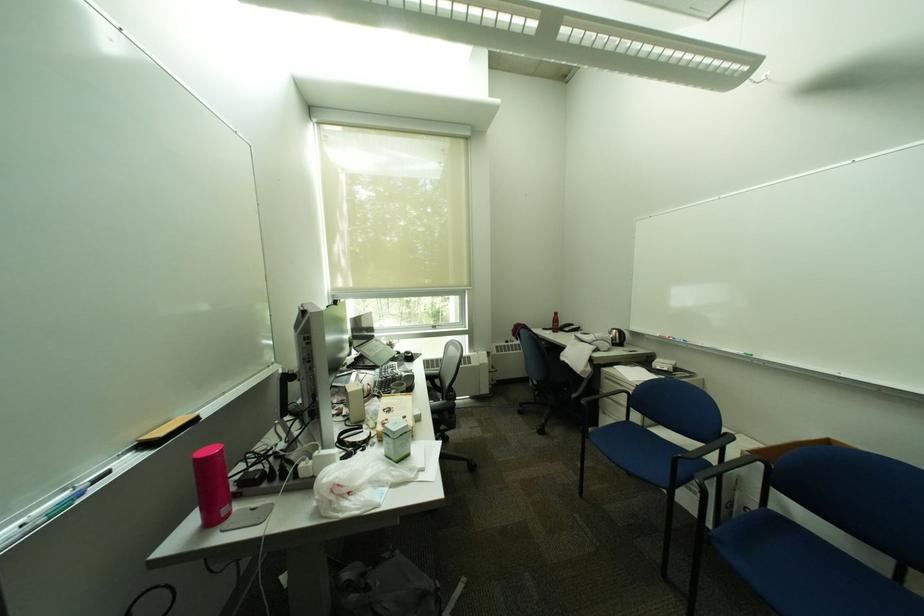
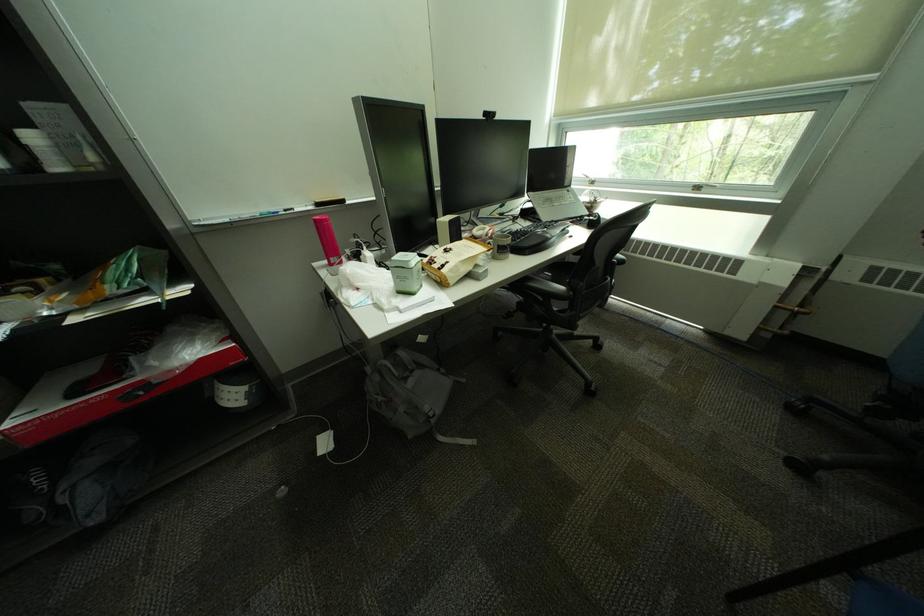
Based on the continuous images, in which direction is the camera rotating?

The camera's rotation is toward left-down.